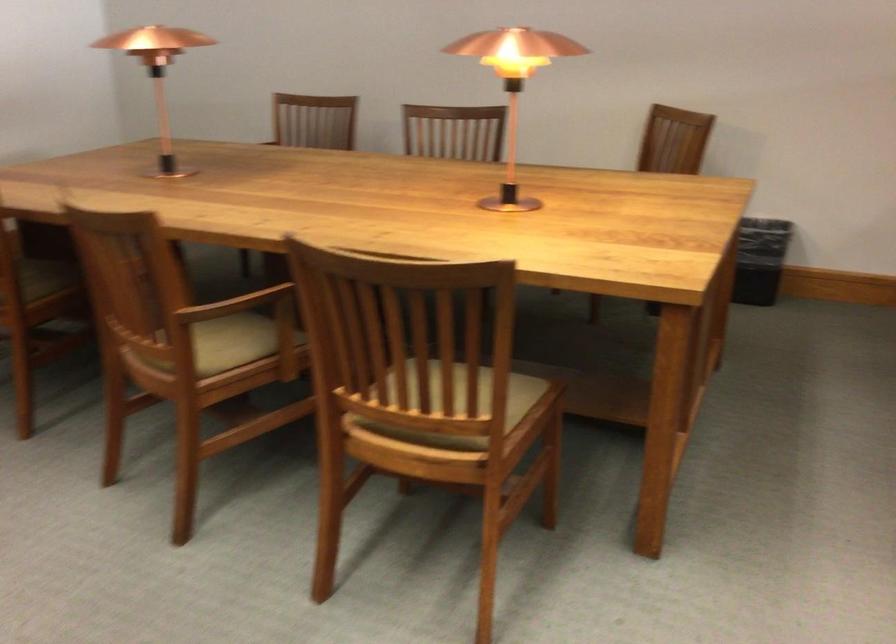
Describe the element at coordinates (236, 304) in the screenshot. The width and height of the screenshot is (896, 644). I see `the wooden chair armrest` at that location.